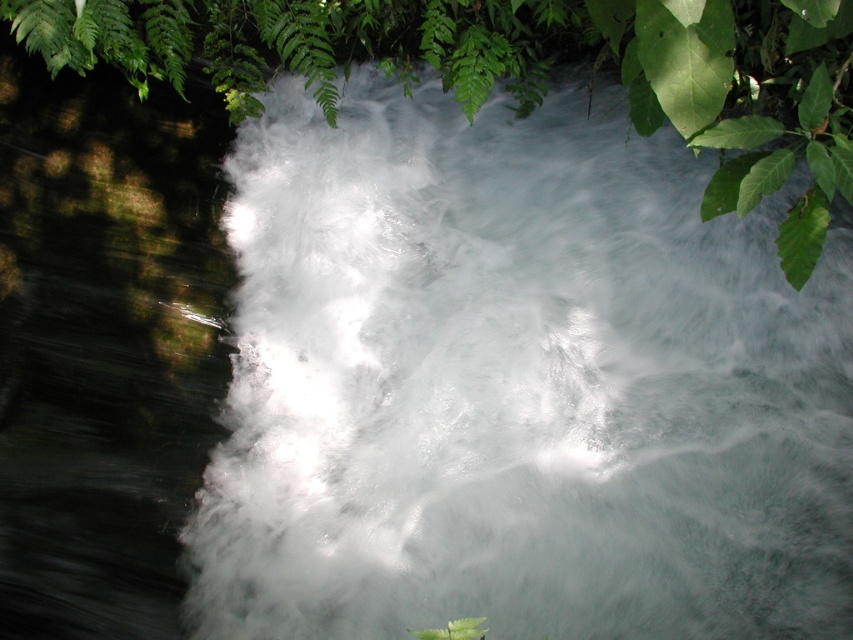
Question: Does green leafy tree at upper center lie behind green matte leaf at upper right?

Choices:
 (A) yes
 (B) no

Answer: (A)

Question: Which point appears closest to the camera in this image?

Choices:
 (A) (674, 88)
 (B) (708, 72)

Answer: (B)

Question: Does green leafy tree at upper center have a lesser width compared to green matte leaf at upper right?

Choices:
 (A) no
 (B) yes

Answer: (A)

Question: Is green leafy tree at upper center smaller than green matte leaf at upper right?

Choices:
 (A) yes
 (B) no

Answer: (B)